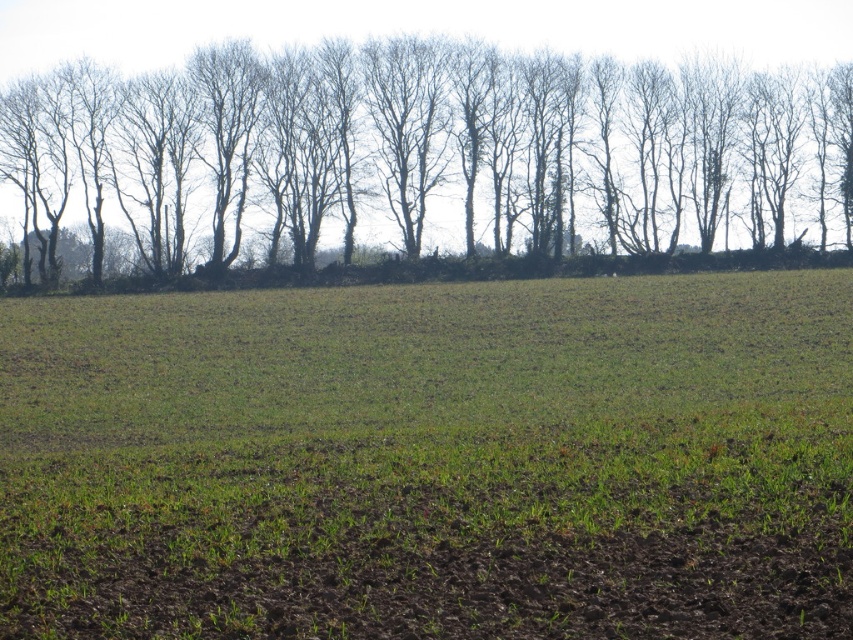
You are standing in the rural landscape and want to walk towards the bare branches at upper center. Which direction should you head from the green grassy field at center?

The green grassy field at center is to the left of the bare branches at upper center, so you should head to the right to reach the bare branches at upper center from the green grassy field at center.

From the picture: You are a farmer checking the field. You notice the green grassy field at center and the bare branches at upper center. Which one has a smaller width?

The green grassy field at center is thinner than the bare branches at upper center, so the green grassy field at center has a smaller width.